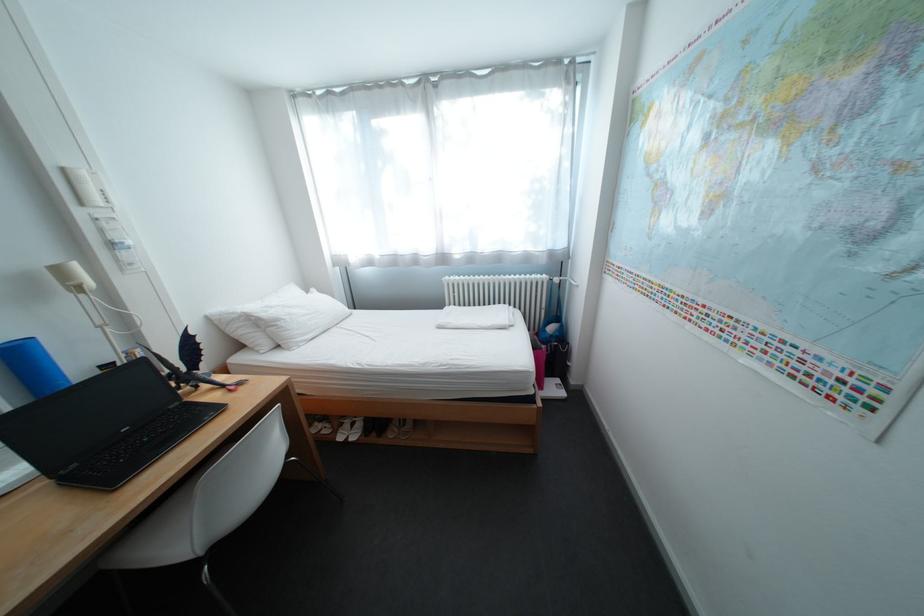
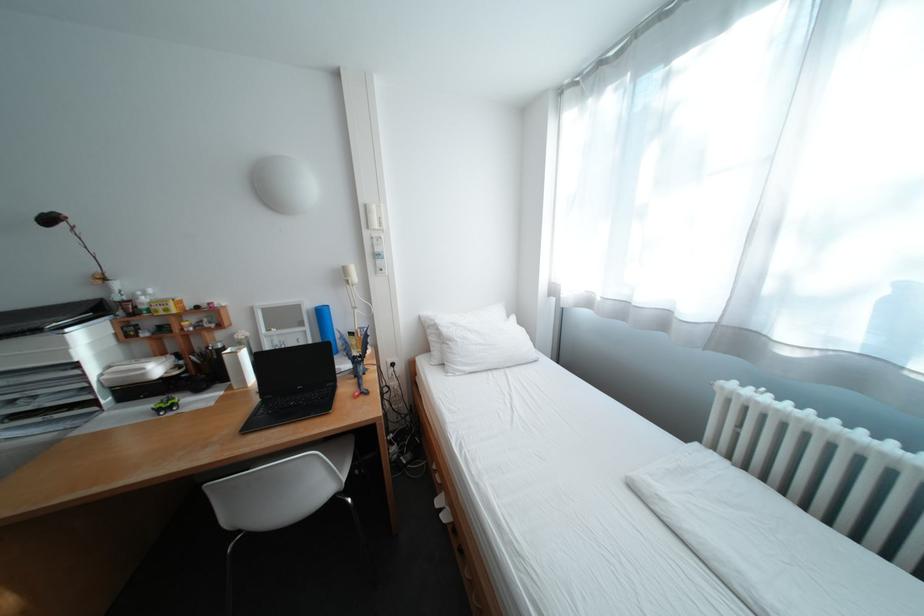
Question: The first image is from the beginning of the video and the second image is from the end. How did the camera likely rotate when shooting the video?

Choices:
 (A) Left
 (B) Right
 (C) Up
 (D) Down

Answer: (A)